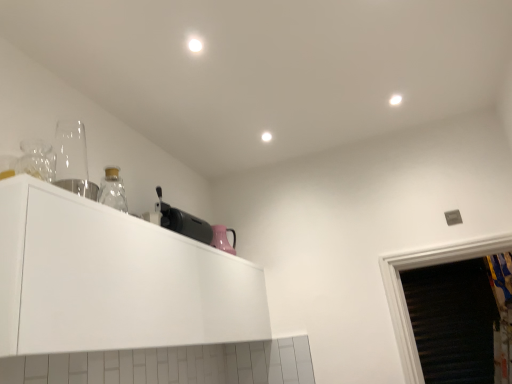
Question: Is transparent glass at left, arranged as the first appliance when viewed from the top, situated inside white glossy cabinet at upper left or outside?

Choices:
 (A) outside
 (B) inside

Answer: (A)

Question: Is transparent glass at left, positioned as the first appliance in front-to-back order, taller or shorter than white glossy cabinet at upper left?

Choices:
 (A) short
 (B) tall

Answer: (A)

Question: Which object is positioned farthest from the black plastic toaster at upper center, positioned as the 1th appliance in back-to-front order?

Choices:
 (A) transparent glass at left, positioned as the first appliance in front-to-back order
 (B) white glossy cabinet at upper left

Answer: (A)

Question: Which object is the closest to the transparent glass at left, which is the 2th appliance from right to left?

Choices:
 (A) black plastic toaster at upper center, the 2th appliance in the left-to-right sequence
 (B) white glossy cabinet at upper left

Answer: (B)